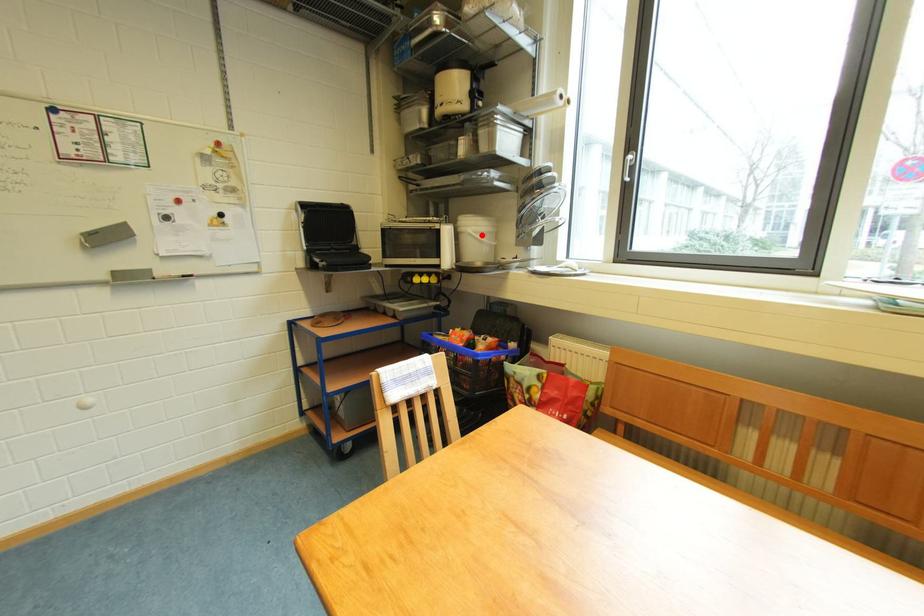
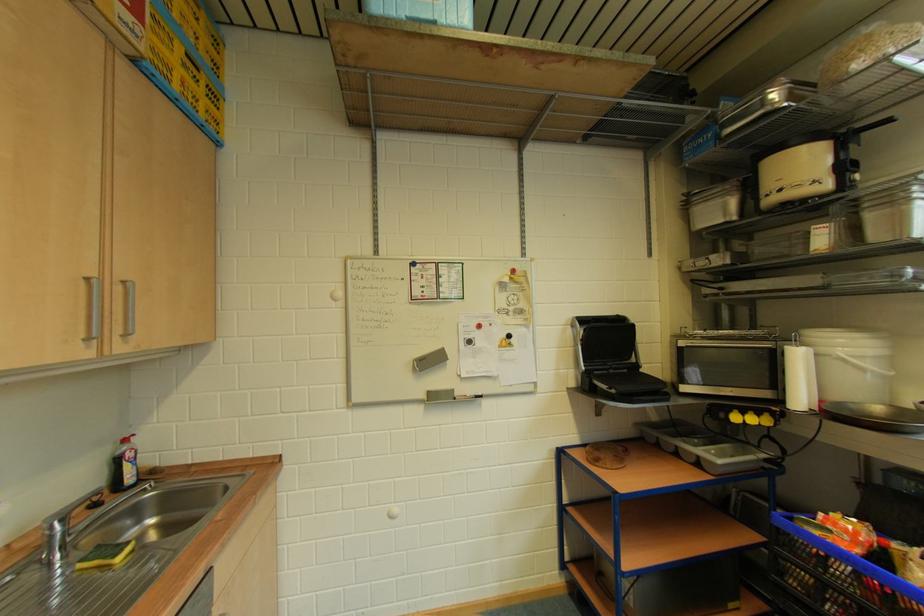
The point at the highlighted location is marked in the first image. Where is the corresponding point in the second image?

(858, 360)